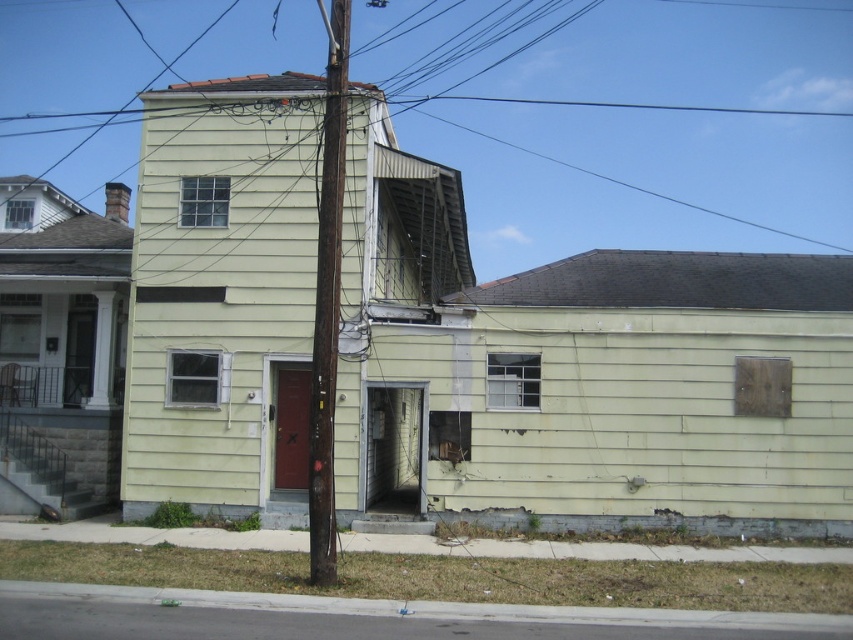
Can you confirm if metallic wire at upper center is positioned to the right of brown wooden telegraph pole at center?

Yes, metallic wire at upper center is to the right of brown wooden telegraph pole at center.

Where is `metallic wire at upper center`? Image resolution: width=853 pixels, height=640 pixels. metallic wire at upper center is located at coordinates (631, 122).